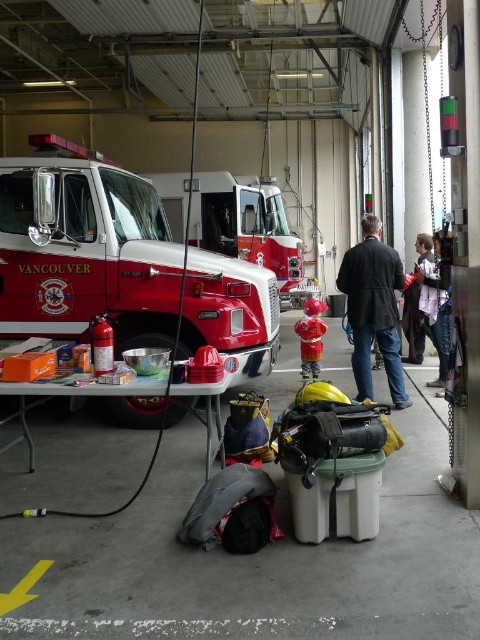
Question: Which point appears farthest from the camera in this image?

Choices:
 (A) (409, 307)
 (B) (298, 268)

Answer: (B)

Question: Is dark brown leather jacket at center to the right of shiny metallic hydrant at center from the viewer's perspective?

Choices:
 (A) no
 (B) yes

Answer: (B)

Question: Which point is closer to the camera taking this photo?

Choices:
 (A) (247, 257)
 (B) (59, 257)
 (C) (301, 355)

Answer: (B)

Question: Which point is closer to the camera taking this photo?

Choices:
 (A) (316, 328)
 (B) (425, 330)
 (C) (262, 195)

Answer: (A)

Question: Is dark brown leather jacket at center closer to camera compared to red matte fire extinguisher at left?

Choices:
 (A) no
 (B) yes

Answer: (A)

Question: From the image, what is the correct spatial relationship of red glossy fire truck at center in relation to dark brown leather jacket at center?

Choices:
 (A) below
 (B) above

Answer: (B)